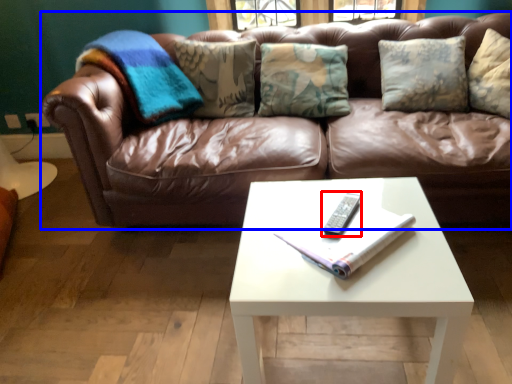
Question: Which object is further to the camera taking this photo, remote (highlighted by a red box) or studio couch (highlighted by a blue box)?

Choices:
 (A) remote
 (B) studio couch

Answer: (B)